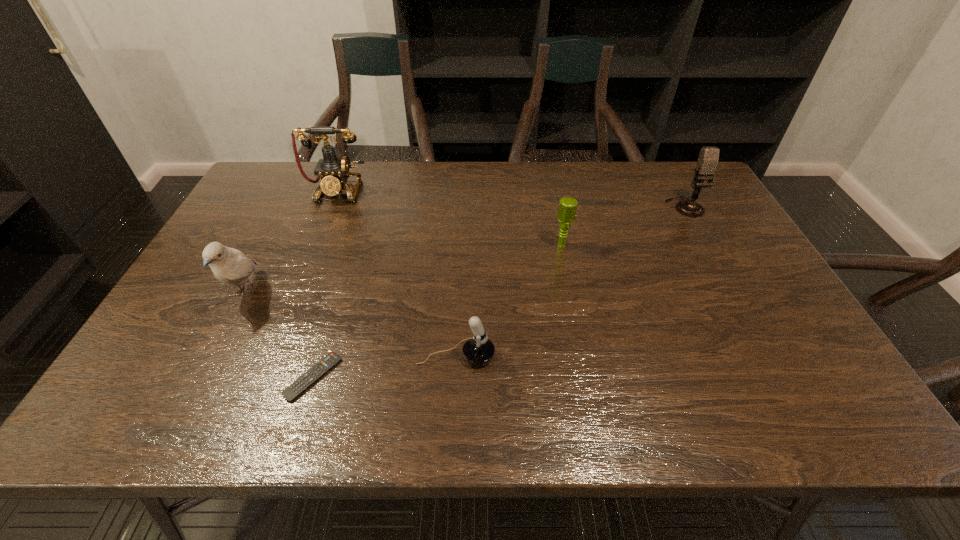
Locate which microphone ranks second in proximity to the rightmost object. Please provide its 2D coordinates. Your answer should be formatted as a tuple, i.e. [(x, y)], where the tuple contains the x and y coordinates of a point satisfying the conditions above.

[(478, 350)]

This screenshot has height=540, width=960. I want to click on free location that satisfies the following two spatial constraints: 1. at the beak of the shortest object; 2. on the left side of the third nearest object, so click(x=204, y=377).

Identify the location of vacant area that satisfies the following two spatial constraints: 1. on the front of the telephone, featuring the rotary dial; 2. on the left side of the shortest microphone. (272, 356).

You are a GUI agent. You are given a task and a screenshot of the screen. Output one action in this format:
    pyautogui.click(x=<x>, y=<y>)
    Task: Click on the vacant space that satisfies the following two spatial constraints: 1. at the beak of the fourth farthest object; 2. on the left side of the nearest microphone
    Image resolution: width=960 pixels, height=540 pixels.
    Given the screenshot: What is the action you would take?
    pyautogui.click(x=215, y=356)

This screenshot has width=960, height=540. Identify the location of free space that satisfies the following two spatial constraints: 1. on the back side of the second nearest microphone; 2. on the right side of the remote control. click(x=354, y=246).

The image size is (960, 540). Identify the location of vacant region that satisfies the following two spatial constraints: 1. on the front of the fifth tallest object, featuring the rotary dial; 2. on the left side of the telephone. (272, 356).

Find the location of `free space that satisfies the following two spatial constraints: 1. on the front of the telephone, featuring the rotary dial; 2. on the right side of the second microphone from left to right`. free space that satisfies the following two spatial constraints: 1. on the front of the telephone, featuring the rotary dial; 2. on the right side of the second microphone from left to right is located at coordinates (316, 246).